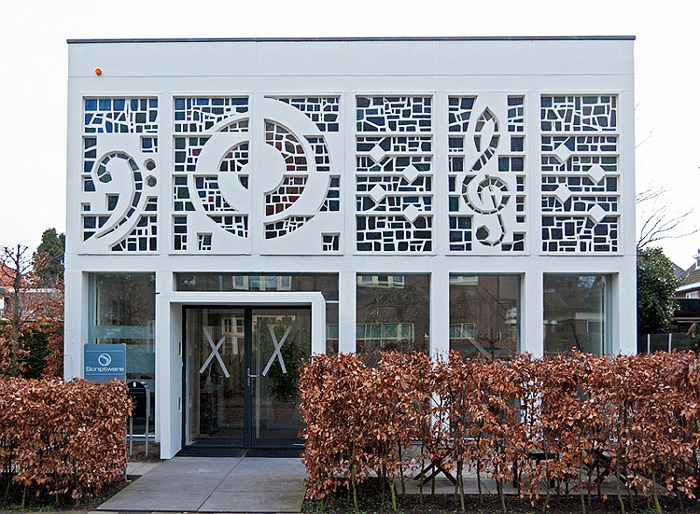
Identify the location of panes of glass left and right of double doors. Image resolution: width=700 pixels, height=514 pixels. (556, 314), (484, 324), (397, 332), (131, 299).